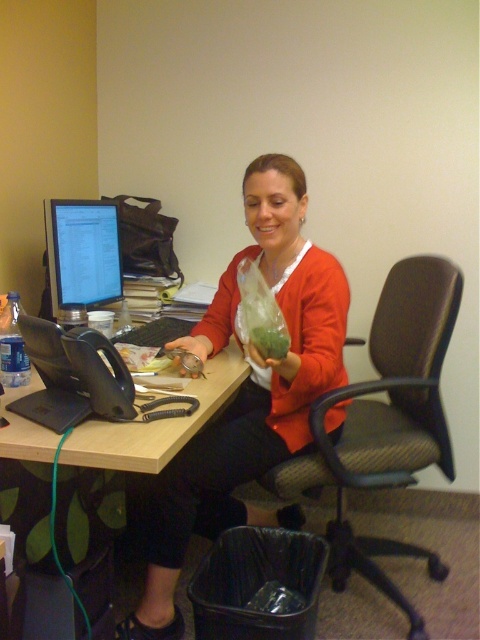
You are organizing the office space and need to move the brown fabric swivel chair at center to make room for a new filing cabinet. Since the wooden desk at center is in the way, can you slide the chair out from under the desk easily?

The brown fabric swivel chair at center is located above wooden desk at center, which means the chair is already positioned on top of the desk. To move it, you can simply lift or slide it off the desk since it isn